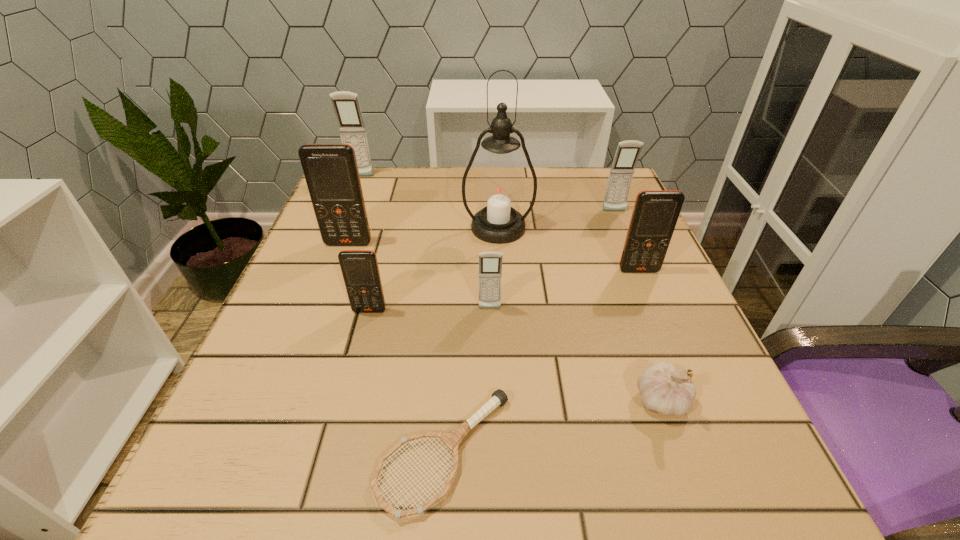
This screenshot has height=540, width=960. What are the coordinates of `oil lamp` in the screenshot? It's located at (499, 190).

The width and height of the screenshot is (960, 540). Find the location of `the leftmost gray cellular telephone`. the leftmost gray cellular telephone is located at coordinates (346, 105).

Identify the location of the farthest object. The width and height of the screenshot is (960, 540). (346, 105).

Find the location of a particular element. the leftmost orange cellular telephone is located at coordinates (331, 172).

This screenshot has height=540, width=960. Find the location of `the farthest orange cellular telephone`. the farthest orange cellular telephone is located at coordinates (331, 172).

At what (x,y) coordinates should I click in order to perform the action: click on the rightmost gray cellular telephone. Please return your answer as a coordinate pair (x, y). The height and width of the screenshot is (540, 960). Looking at the image, I should click on (627, 153).

Where is `the second farthest gray cellular telephone`? the second farthest gray cellular telephone is located at coordinates (x=627, y=153).

I want to click on the fifth nearest object, so click(655, 214).

You are a GUI agent. You are given a task and a screenshot of the screen. Output one action in this format:
    pyautogui.click(x=<x>, y=<y>)
    Task: Click on the rightmost orange cellular telephone
    Image resolution: width=960 pixels, height=540 pixels.
    Given the screenshot: What is the action you would take?
    pyautogui.click(x=655, y=214)

Identify the location of the nearest orange cellular telephone. The image size is (960, 540). (360, 270).